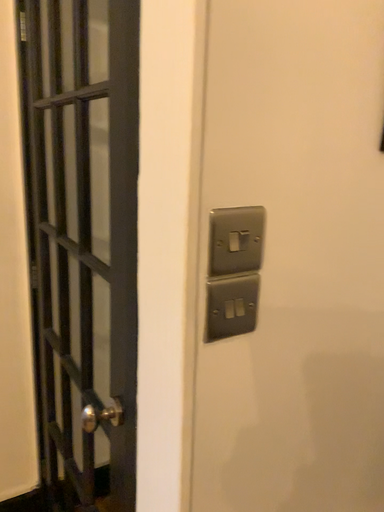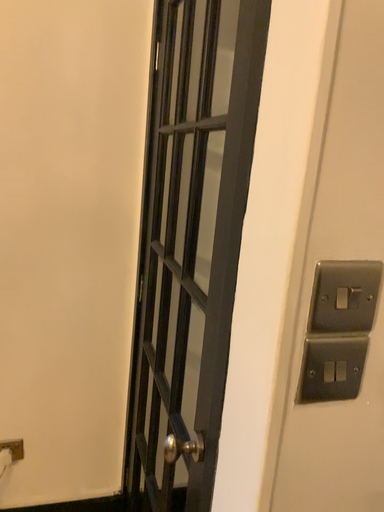
Question: How did the camera likely rotate when shooting the video?

Choices:
 (A) rotated left
 (B) rotated right

Answer: (A)